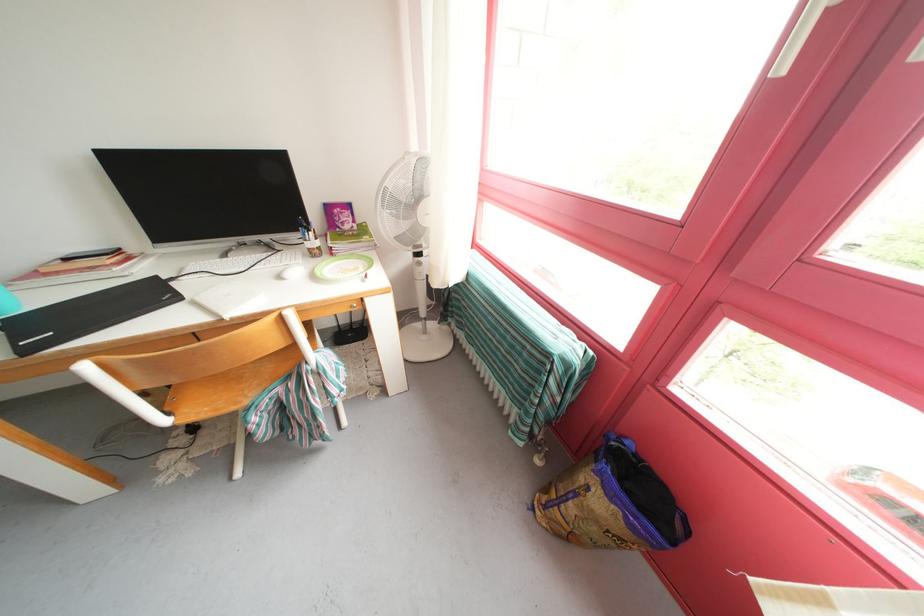
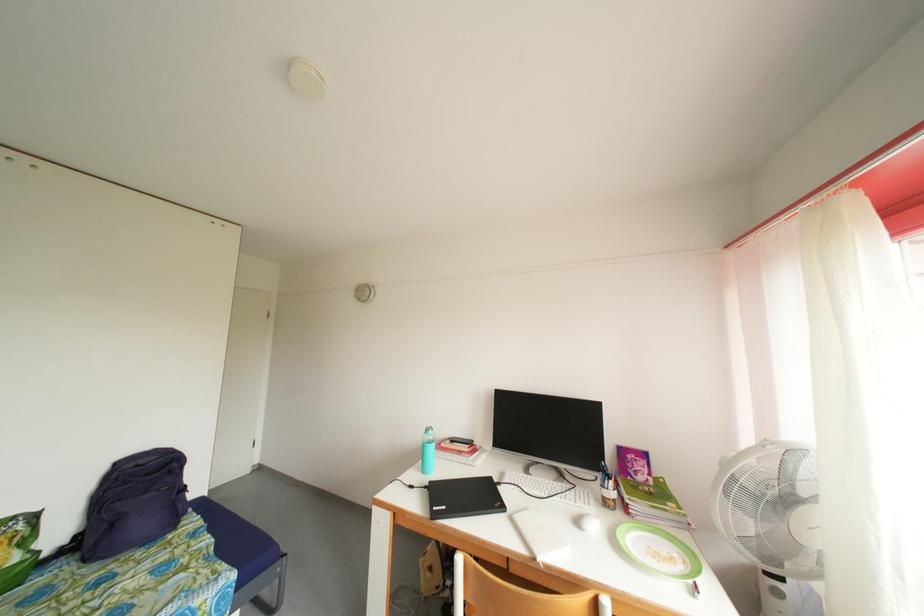
The first image is from the beginning of the video and the second image is from the end. How did the camera likely rotate when shooting the video?

The camera rotated toward left-up.